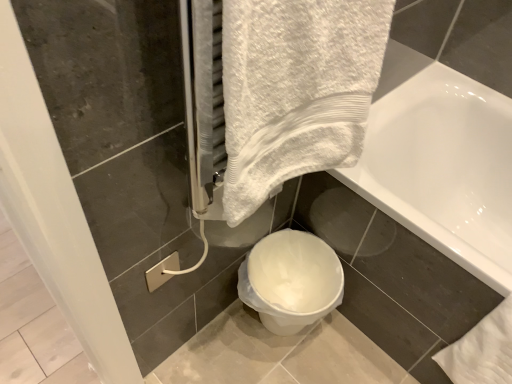
Question: Can you confirm if white glossy bathtub at upper right is taller than white plastic toilet at lower center?

Choices:
 (A) no
 (B) yes

Answer: (B)

Question: From the image's perspective, does white glossy bathtub at upper right appear higher than white plastic toilet at lower center?

Choices:
 (A) yes
 (B) no

Answer: (A)

Question: Is white glossy bathtub at upper right smaller than white plastic toilet at lower center?

Choices:
 (A) no
 (B) yes

Answer: (A)

Question: Is white plastic toilet at lower center completely or partially inside white glossy bathtub at upper right?

Choices:
 (A) yes
 (B) no

Answer: (B)

Question: Does white glossy bathtub at upper right lie in front of white plastic toilet at lower center?

Choices:
 (A) no
 (B) yes

Answer: (B)

Question: Is white plastic toilet at lower center at the back of white glossy bathtub at upper right?

Choices:
 (A) yes
 (B) no

Answer: (B)

Question: Considering the relative sizes of white plastic toilet at lower center and white glossy bathtub at upper right in the image provided, is white plastic toilet at lower center smaller than white glossy bathtub at upper right?

Choices:
 (A) no
 (B) yes

Answer: (B)

Question: Considering the relative sizes of white plastic toilet at lower center and white glossy bathtub at upper right in the image provided, is white plastic toilet at lower center thinner than white glossy bathtub at upper right?

Choices:
 (A) yes
 (B) no

Answer: (A)

Question: Does white plastic toilet at lower center lie behind white glossy bathtub at upper right?

Choices:
 (A) yes
 (B) no

Answer: (A)

Question: Would you consider white plastic toilet at lower center to be distant from white glossy bathtub at upper right?

Choices:
 (A) yes
 (B) no

Answer: (B)

Question: From a real-world perspective, is white plastic toilet at lower center positioned over white glossy bathtub at upper right based on gravity?

Choices:
 (A) no
 (B) yes

Answer: (A)

Question: From the image's perspective, would you say white plastic toilet at lower center is positioned over white glossy bathtub at upper right?

Choices:
 (A) no
 (B) yes

Answer: (A)

Question: Considering the positions of white plastic toilet at lower center and white glossy bathtub at upper right in the image, is white plastic toilet at lower center taller or shorter than white glossy bathtub at upper right?

Choices:
 (A) short
 (B) tall

Answer: (A)